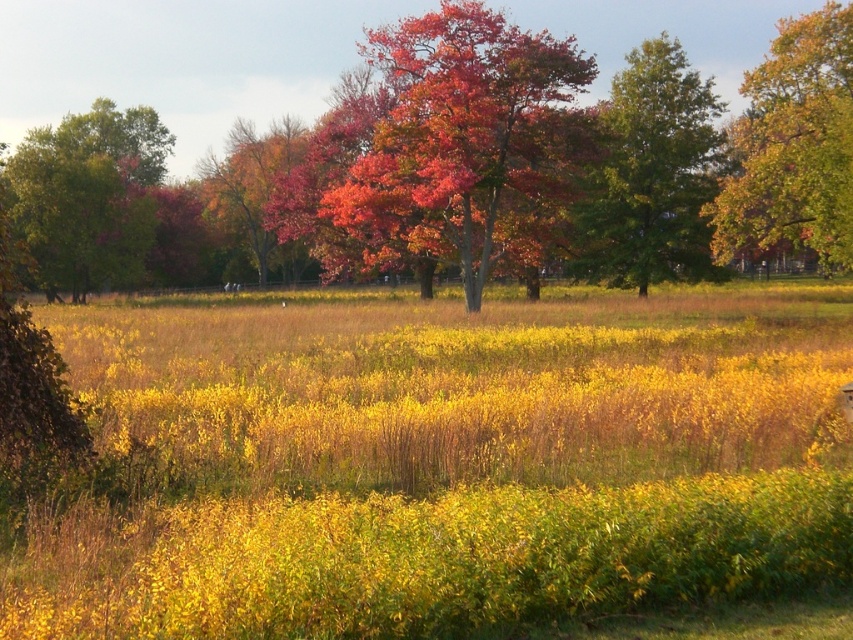
Looking at this image, can you confirm if green leafy tree at left is positioned to the left of shiny orange tree at center?

Correct, you'll find green leafy tree at left to the left of shiny orange tree at center.

Is green leafy tree at left to the right of shiny orange tree at center from the viewer's perspective?

In fact, green leafy tree at left is to the left of shiny orange tree at center.

Who is more distant from viewer, (x=129, y=250) or (x=251, y=177)?

Point (x=251, y=177)

This screenshot has width=853, height=640. In order to click on green leafy tree at left in this screenshot , I will do `click(88, 195)`.

Which of these two, shiny red leaves at center or green leafy tree at left, stands taller?

shiny red leaves at center is taller.

This screenshot has height=640, width=853. Find the location of `shiny red leaves at center`. shiny red leaves at center is located at coordinates (178, 60).

Identify the location of shiny red leaves at center. The height and width of the screenshot is (640, 853). (178, 60).

Does green leafy tree at center appear over green leafy tree at left?

No.

Which of these two, green leafy tree at center or green leafy tree at left, stands shorter?

Standing shorter between the two is green leafy tree at center.

Which is behind, point (706, 92) or point (140, 124)?

The point (140, 124) is behind.

Where is `green leafy tree at center`? The height and width of the screenshot is (640, 853). green leafy tree at center is located at coordinates (650, 173).